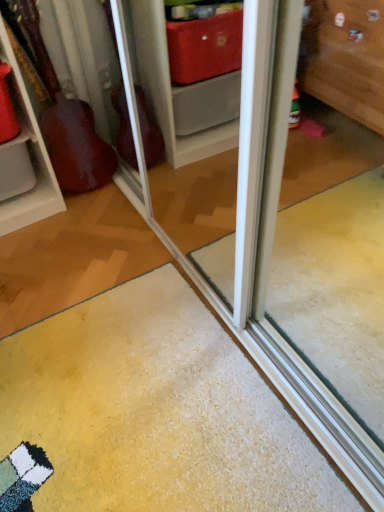
You are a GUI agent. You are given a task and a screenshot of the screen. Output one action in this format:
    pyautogui.click(x=<x>, y=<y>)
    Task: Click on the yellow carpet at lower center
    The image size is (384, 512).
    Given the screenshot: What is the action you would take?
    pyautogui.click(x=151, y=413)

This screenshot has width=384, height=512. What do you see at coordinates (151, 413) in the screenshot? I see `yellow carpet at lower center` at bounding box center [151, 413].

You are a GUI agent. You are given a task and a screenshot of the screen. Output one action in this format:
    pyautogui.click(x=<x>, y=<y>)
    Task: Click on the wooden guitar at left
    This screenshot has height=512, width=384.
    Given the screenshot: What is the action you would take?
    pyautogui.click(x=30, y=156)

What is the approximate width of wooden guitar at left?

wooden guitar at left is 6.40 inches in width.

This screenshot has width=384, height=512. What do you see at coordinates (30, 156) in the screenshot?
I see `wooden guitar at left` at bounding box center [30, 156].

The height and width of the screenshot is (512, 384). I want to click on yellow carpet at lower center, so click(151, 413).

Is wooden guitar at left at the left side of yellow carpet at lower center?

Correct, you'll find wooden guitar at left to the left of yellow carpet at lower center.

Between wooden guitar at left and yellow carpet at lower center, which one is positioned in front?

yellow carpet at lower center is in front.

Is point (35, 147) positioned behind point (260, 399)?

Yes.

From the image's perspective, does wooden guitar at left appear lower than yellow carpet at lower center?

No.

Looking at this image, from a real-world perspective, who is located lower, wooden guitar at left or yellow carpet at lower center?

From a 3D spatial view, yellow carpet at lower center is below.

Considering the relative sizes of wooden guitar at left and yellow carpet at lower center in the image provided, is wooden guitar at left wider than yellow carpet at lower center?

Incorrect, the width of wooden guitar at left does not surpass that of yellow carpet at lower center.

Considering the sizes of wooden guitar at left and yellow carpet at lower center in the image, is wooden guitar at left taller or shorter than yellow carpet at lower center?

Considering their sizes, wooden guitar at left has more height than yellow carpet at lower center.

Does wooden guitar at left have a larger size compared to yellow carpet at lower center?

No, wooden guitar at left is not bigger than yellow carpet at lower center.

Is wooden guitar at left outside of yellow carpet at lower center?

Yes, wooden guitar at left is not within yellow carpet at lower center.

Is wooden guitar at left with yellow carpet at lower center?

There is a gap between wooden guitar at left and yellow carpet at lower center.

Could you tell me if wooden guitar at left is facing yellow carpet at lower center?

Yes, wooden guitar at left is facing yellow carpet at lower center.

How different are the orientations of wooden guitar at left and yellow carpet at lower center in degrees?

The angular difference between wooden guitar at left and yellow carpet at lower center is 90.1 degrees.

How distant is wooden guitar at left from yellow carpet at lower center?

The distance of wooden guitar at left from yellow carpet at lower center is 33.58 inches.

I want to click on doormat below the wooden guitar at left (from a real-world perspective), so click(x=151, y=413).

Which is more to the right, yellow carpet at lower center or wooden guitar at left?

yellow carpet at lower center.

Is the position of yellow carpet at lower center more distant than that of wooden guitar at left?

No, the depth of yellow carpet at lower center is less than that of wooden guitar at left.

Between point (190, 303) and point (19, 80), which one is positioned behind?

Positioned behind is point (19, 80).

From the image's perspective, which is below, yellow carpet at lower center or wooden guitar at left?

yellow carpet at lower center.

From a real-world perspective, is yellow carpet at lower center on wooden guitar at left?

No, from a real-world perspective, yellow carpet at lower center is not over wooden guitar at left

Can you confirm if yellow carpet at lower center is thinner than wooden guitar at left?

In fact, yellow carpet at lower center might be wider than wooden guitar at left.

Can you confirm if yellow carpet at lower center is shorter than wooden guitar at left?

Yes.

Can you confirm if yellow carpet at lower center is smaller than wooden guitar at left?

No.

Do you think yellow carpet at lower center is within wooden guitar at left, or outside of it?

yellow carpet at lower center lies outside wooden guitar at left.

Are yellow carpet at lower center and wooden guitar at left beside each other?

yellow carpet at lower center and wooden guitar at left are clearly separated.

Is yellow carpet at lower center aimed at wooden guitar at left?

No, yellow carpet at lower center is not oriented towards wooden guitar at left.

How different are the orientations of yellow carpet at lower center and wooden guitar at left in degrees?

The angular difference between yellow carpet at lower center and wooden guitar at left is 90.1 degrees.

From the picture: Measure the distance from yellow carpet at lower center to wooden guitar at left.

They are 85.30 centimeters apart.

Where is `shelf that appears above the yellow carpet at lower center (from the image's perspective)`? shelf that appears above the yellow carpet at lower center (from the image's perspective) is located at coordinates (30, 156).

Image resolution: width=384 pixels, height=512 pixels. Identify the location of doormat that is in front of the wooden guitar at left. (151, 413).

At what (x,y) coordinates should I click in order to perform the action: click on shelf lying behind the yellow carpet at lower center. Please return your answer as a coordinate pair (x, y). The width and height of the screenshot is (384, 512). Looking at the image, I should click on (30, 156).